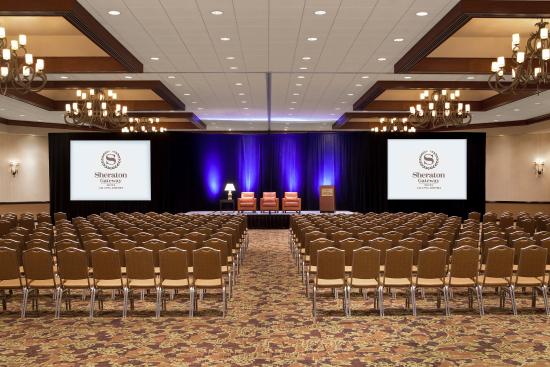
I want to click on seat, so click(162, 219).